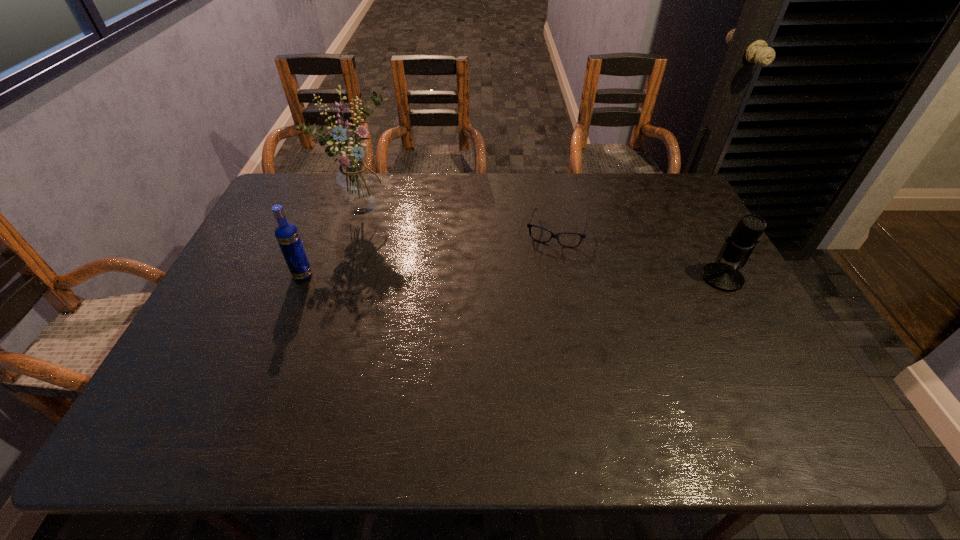
Where is `free spot on the desktop that is between the vodka and the rightmost object and is positioned on the front-facing side of the second object from right to left`? free spot on the desktop that is between the vodka and the rightmost object and is positioned on the front-facing side of the second object from right to left is located at coordinates (543, 276).

At what (x,y) coordinates should I click in order to perform the action: click on vacant space on the desktop that is between the vodka and the microphone and is positioned on the front-facing side of the bouquet. Please return your answer as a coordinate pair (x, y). Looking at the image, I should click on pyautogui.click(x=454, y=276).